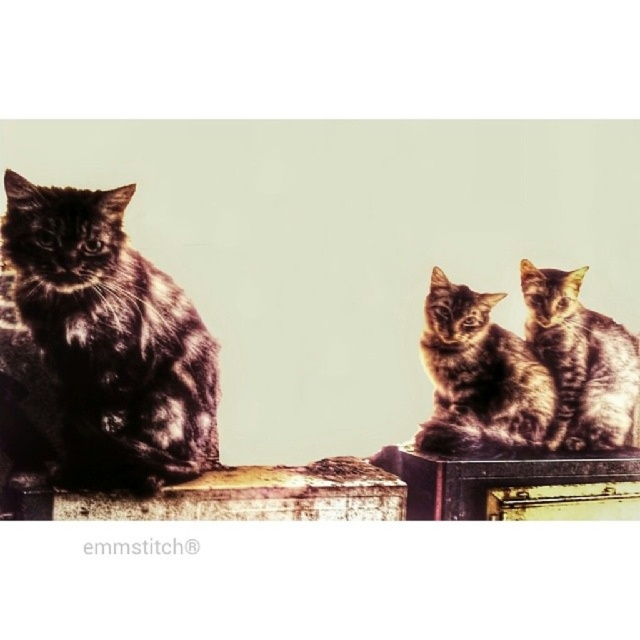
Between point (28, 243) and point (582, 444), which one is positioned in front?

Positioned in front is point (28, 243).

Describe the element at coordinates (112, 339) in the screenshot. The width and height of the screenshot is (640, 640). I see `shiny black cat at left` at that location.

Between point (188, 422) and point (621, 417), which one is positioned behind?

The point (621, 417) is behind.

Where is `shiny black cat at left`? Image resolution: width=640 pixels, height=640 pixels. shiny black cat at left is located at coordinates click(x=112, y=339).

Who is more distant from viewer, [32,292] or [534,422]?

Point [534,422]

Between shiny black cat at left and shiny brown fur at center, which one appears on the right side from the viewer's perspective?

shiny brown fur at center

This screenshot has width=640, height=640. I want to click on shiny black cat at left, so click(112, 339).

This screenshot has height=640, width=640. Identify the location of shiny black cat at left. (112, 339).

Between shiny brown fur at center and tabby fur cat at right, which one has more height?

tabby fur cat at right

Does point (433, 380) come farther from viewer compared to point (586, 321)?

No.

Identify the location of shiny brown fur at center. (477, 376).